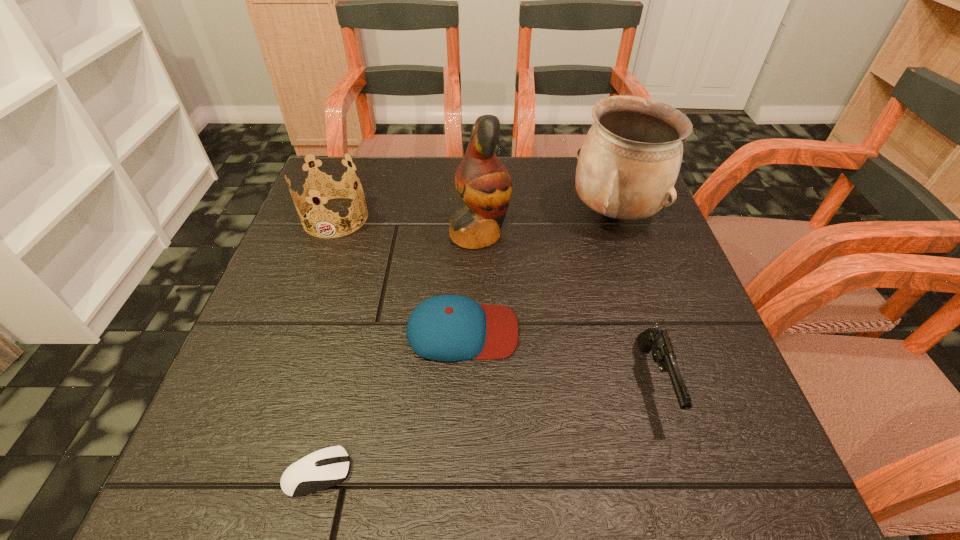
At what (x,y) coordinates should I click in order to perform the action: click on object positioned at the far left corner. Please return your answer as a coordinate pair (x, y). This screenshot has width=960, height=540. Looking at the image, I should click on (326, 187).

Identify the location of object positioned at the near left corner. The image size is (960, 540). (321, 469).

At what (x,y) coordinates should I click in order to perform the action: click on object that is at the far right corner. Please return your answer as a coordinate pair (x, y). The image size is (960, 540). Looking at the image, I should click on (628, 164).

This screenshot has width=960, height=540. I want to click on blank space at the far edge of the desktop, so click(572, 189).

Locate an element on the screen. The height and width of the screenshot is (540, 960). free location at the left edge of the desktop is located at coordinates (324, 286).

In the image, there is a desktop. At what (x,y) coordinates should I click in order to perform the action: click on free region at the right edge. Please return your answer as a coordinate pair (x, y). This screenshot has height=540, width=960. Looking at the image, I should click on (617, 288).

Identify the location of vacant space at the far left corner of the desktop. The image size is (960, 540). (374, 185).

Where is `free region at the near right corner of the desktop`? This screenshot has width=960, height=540. free region at the near right corner of the desktop is located at coordinates (732, 494).

Locate an element on the screen. The width and height of the screenshot is (960, 540). free space between the urn and the gun is located at coordinates (635, 298).

I want to click on free space that is in between the second shortest object and the crown, so click(x=399, y=274).